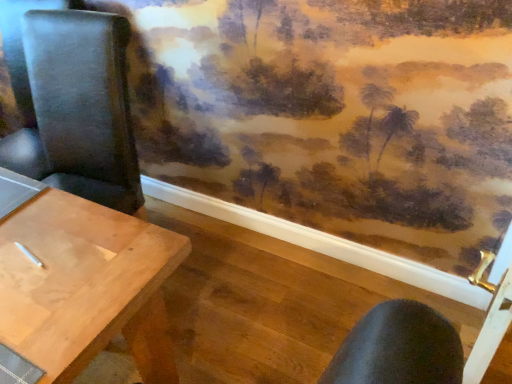
Question: Relative to black leather chair at left, is light brown wood table at left in front or behind?

Choices:
 (A) behind
 (B) front

Answer: (B)

Question: Is point (24, 263) closer or farther from the camera than point (74, 122)?

Choices:
 (A) farther
 (B) closer

Answer: (B)

Question: Considering the relative positions of light brown wood table at left and black leather chair at left in the image provided, is light brown wood table at left to the left or to the right of black leather chair at left?

Choices:
 (A) right
 (B) left

Answer: (B)

Question: Do you think black leather chair at left is within light brown wood table at left, or outside of it?

Choices:
 (A) outside
 (B) inside

Answer: (A)

Question: Is black leather chair at left to the left or to the right of light brown wood table at left in the image?

Choices:
 (A) right
 (B) left

Answer: (A)

Question: Considering their positions, is black leather chair at left located in front of or behind light brown wood table at left?

Choices:
 (A) behind
 (B) front

Answer: (A)

Question: Does point (122, 162) appear closer or farther from the camera than point (20, 299)?

Choices:
 (A) closer
 (B) farther

Answer: (B)